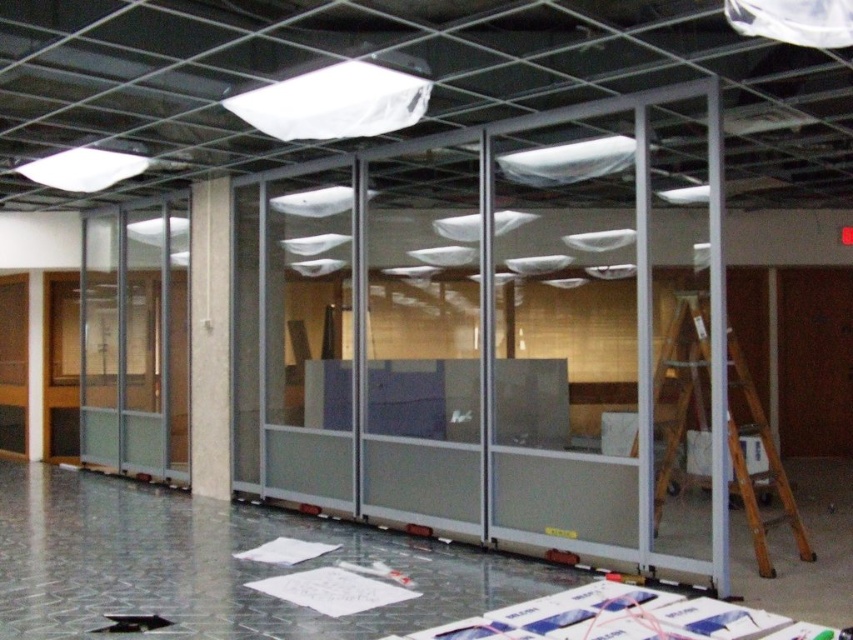
Consider the image. You are a construction worker needing to retrieve a tool from the top of the white marble pillar at center. The wooden ladder at right is positioned to the right of it. Can you safely place the ladder against the pillar to climb up?

The wooden ladder at right is to the right of the white marble pillar at center, so you can move the ladder to the left to position it against the pillar and safely climb up.

You are an inspector checking the construction site. You see the white marble pillar at center and the white matte paper at lower center. Which object is closer to you?

The white marble pillar at center is closer to you because it is further to the viewer than the white matte paper at lower center.

You are a construction worker who needs to move the wooden ladder at right and the white marble pillar at center to clear a path. Which object should you move first if you want to prioritize moving the wider object first?

The wooden ladder at right is wider than the white marble pillar at center, so you should move the wooden ladder at right first.